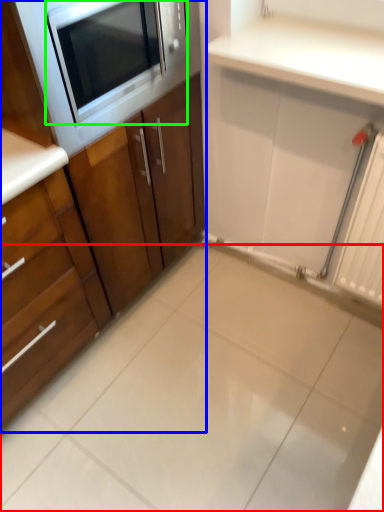
Question: Based on their relative distances, which object is farther from ceramic tile (highlighted by a red box)? Choose from cabinetry (highlighted by a blue box) and microwave oven (highlighted by a green box).

Choices:
 (A) cabinetry
 (B) microwave oven

Answer: (B)